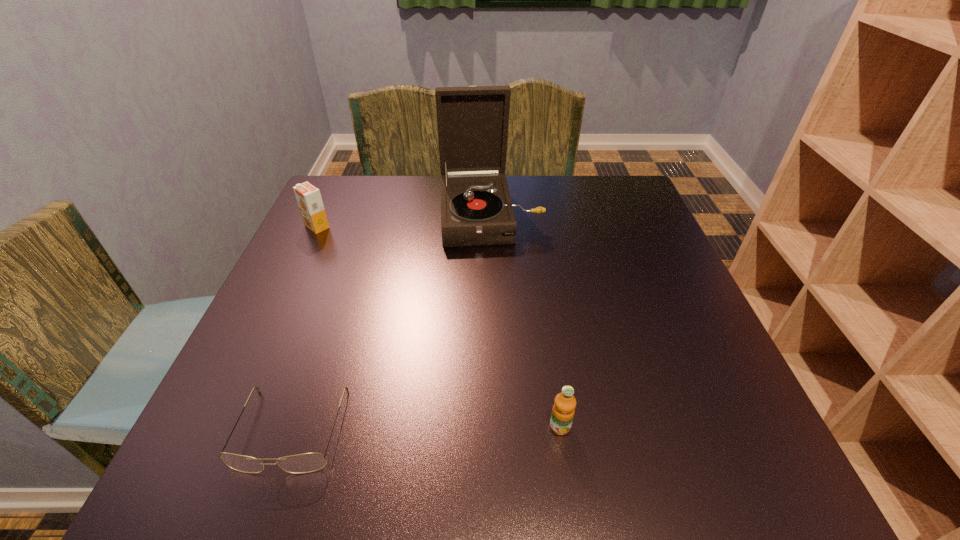
Find the location of a particular element. This screenshot has width=960, height=540. blank region between the farther orange juice and the shortest object is located at coordinates (304, 328).

Identify which object is the second nearest to the spectacles. Please provide its 2D coordinates. Your answer should be formatted as a tuple, i.e. [(x, y)], where the tuple contains the x and y coordinates of a point satisfying the conditions above.

[(476, 209)]

The width and height of the screenshot is (960, 540). I want to click on object that is the third closest to the farther orange juice, so click(x=563, y=411).

Locate an element on the screen. blank area in the image that satisfies the following two spatial constraints: 1. on the back side of the tallest object; 2. on the right side of the left orange juice is located at coordinates (323, 215).